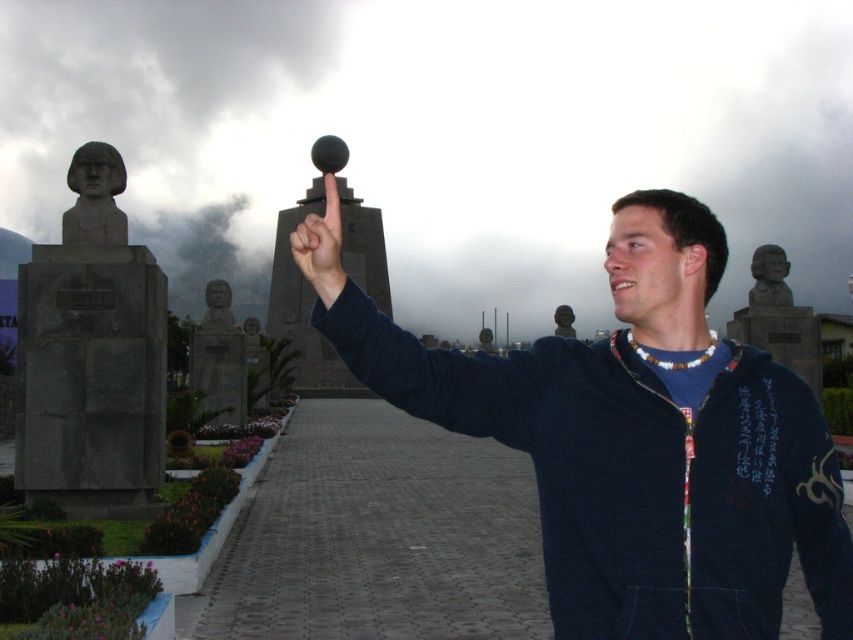
The image size is (853, 640). What do you see at coordinates (96, 196) in the screenshot?
I see `matte gray stone bust at upper left` at bounding box center [96, 196].

Is point (96, 218) in front of point (221, 301)?

Yes, point (96, 218) is closer to viewer.

Where is `matte gray stone bust at upper left`? matte gray stone bust at upper left is located at coordinates (96, 196).

The image size is (853, 640). Identify the location of gray stone bust at left. (91, 356).

This screenshot has width=853, height=640. Describe the element at coordinates (91, 356) in the screenshot. I see `gray stone bust at left` at that location.

Which is in front, point (154, 300) or point (74, 211)?

Point (154, 300)

At what (x,y) coordinates should I click in order to perform the action: click on gray stone bust at left. Please return your answer as a coordinate pair (x, y). The width and height of the screenshot is (853, 640). Looking at the image, I should click on (91, 356).

Who is more distant from viewer, [73,186] or [315,244]?

Point [73,186]

What do you see at coordinates (91, 356) in the screenshot?
I see `gray stone bust at left` at bounding box center [91, 356].

Identify the location of gray stone bust at left. (91, 356).

Image resolution: width=853 pixels, height=640 pixels. Identify the location of gray stone bust at left. (91, 356).